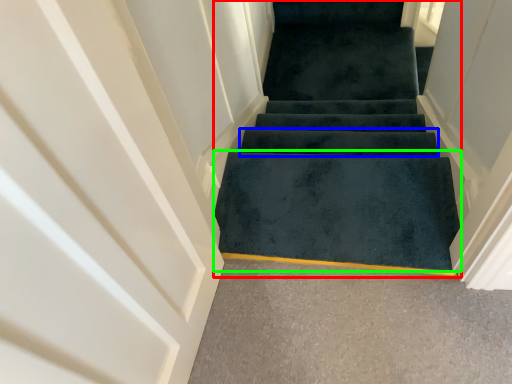
Question: Which object is the farthest from stairs (highlighted by a red box)? Choose among these: stair (highlighted by a blue box) or doormat (highlighted by a green box).

Choices:
 (A) stair
 (B) doormat

Answer: (B)